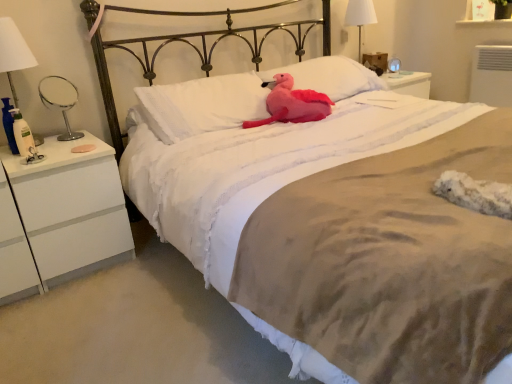
Question: From a real-world perspective, is white fabric lampshade at upper right positioned under metallic silver mirror at left based on gravity?

Choices:
 (A) yes
 (B) no

Answer: (B)

Question: Is white fabric lampshade at upper right oriented towards metallic silver mirror at left?

Choices:
 (A) yes
 (B) no

Answer: (B)

Question: Does white fabric lampshade at upper right contain metallic silver mirror at left?

Choices:
 (A) no
 (B) yes

Answer: (A)

Question: Is white fabric lampshade at upper right smaller than metallic silver mirror at left?

Choices:
 (A) yes
 (B) no

Answer: (B)

Question: Considering the relative sizes of white fabric lampshade at upper right and metallic silver mirror at left in the image provided, is white fabric lampshade at upper right taller than metallic silver mirror at left?

Choices:
 (A) no
 (B) yes

Answer: (B)

Question: Based on their sizes in the image, would you say white soft pillow at center, the second pillow viewed from the right, is bigger or smaller than white matte/finish nightstand at left?

Choices:
 (A) big
 (B) small

Answer: (B)

Question: Considering the positions of white soft pillow at center, the second pillow viewed from the right, and white matte/finish nightstand at left in the image, is white soft pillow at center, the second pillow viewed from the right, taller or shorter than white matte/finish nightstand at left?

Choices:
 (A) tall
 (B) short

Answer: (B)

Question: From a real-world perspective, is white soft pillow at center, the second pillow viewed from the right, above or below white matte/finish nightstand at left?

Choices:
 (A) above
 (B) below

Answer: (A)

Question: Is white soft pillow at center, the second pillow viewed from the right, wider or thinner than white matte/finish nightstand at left?

Choices:
 (A) thin
 (B) wide

Answer: (A)

Question: In terms of width, does fluffy pink plush at center look wider or thinner when compared to white soft pillow at center, acting as the 1th pillow starting from the left?

Choices:
 (A) thin
 (B) wide

Answer: (B)

Question: Is fluffy pink plush at center inside the boundaries of white soft pillow at center, the second pillow viewed from the right, or outside?

Choices:
 (A) outside
 (B) inside

Answer: (B)

Question: Relative to white soft pillow at center, acting as the 1th pillow starting from the left, is fluffy pink plush at center in front or behind?

Choices:
 (A) behind
 (B) front

Answer: (A)

Question: Considering the positions of fluffy pink plush at center and white soft pillow at center, the second pillow viewed from the right, in the image, is fluffy pink plush at center taller or shorter than white soft pillow at center, the second pillow viewed from the right,?

Choices:
 (A) tall
 (B) short

Answer: (B)

Question: Visually, is white matte/finish nightstand at left positioned to the left or to the right of fluffy pink plush at center?

Choices:
 (A) right
 (B) left

Answer: (B)

Question: Is white matte/finish nightstand at left spatially inside fluffy pink plush at center, or outside of it?

Choices:
 (A) inside
 (B) outside

Answer: (B)